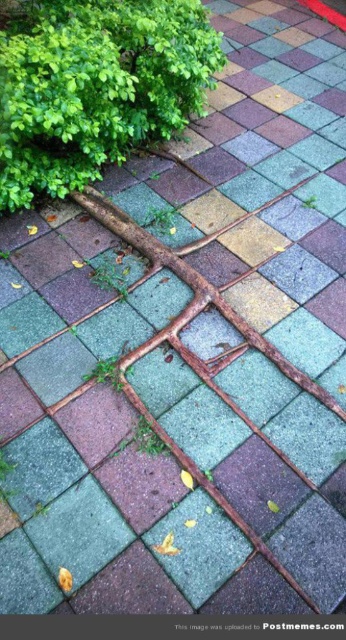
Question: Which point appears closest to the camera in this image?

Choices:
 (A) (192, 36)
 (B) (134, 225)

Answer: (B)

Question: Does green leafy bush at upper left have a lesser width compared to rusty metal tree root at center?

Choices:
 (A) yes
 (B) no

Answer: (A)

Question: Can you confirm if green leafy bush at upper left is wider than rusty metal tree root at center?

Choices:
 (A) no
 (B) yes

Answer: (A)

Question: Which point is closer to the camera taking this photo?

Choices:
 (A) (183, 324)
 (B) (117, 141)

Answer: (A)

Question: Is green leafy bush at upper left thinner than rusty metal tree root at center?

Choices:
 (A) no
 (B) yes

Answer: (B)

Question: Which point is farther to the camera?

Choices:
 (A) rusty metal tree root at center
 (B) green leafy bush at upper left

Answer: (B)